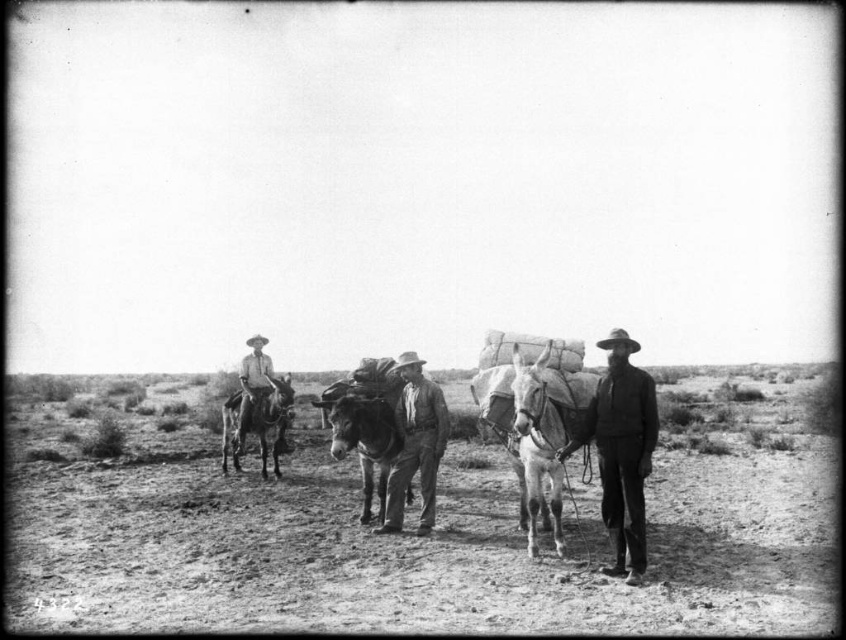
Question: Can you confirm if dirt field at center is positioned above shiny brown horse at center?

Choices:
 (A) no
 (B) yes

Answer: (A)

Question: Which object appears closest to the camera in this image?

Choices:
 (A) shiny brown horse at center
 (B) rough leather hat at center
 (C) shiny brown mule at left
 (D) rugged leather jacket at center

Answer: (A)

Question: Does dirt field at center have a larger size compared to rugged leather jacket at center?

Choices:
 (A) yes
 (B) no

Answer: (A)

Question: Which point is closer to the camera?

Choices:
 (A) (566, 586)
 (B) (332, 397)

Answer: (A)

Question: Does dirt field at center appear under smooth brown mule at center?

Choices:
 (A) no
 (B) yes

Answer: (B)

Question: Considering the real-world distances, which object is farthest from the shiny brown mule at left?

Choices:
 (A) shiny brown horse at center
 (B) rough leather hat at center
 (C) smooth brown mule at center

Answer: (B)